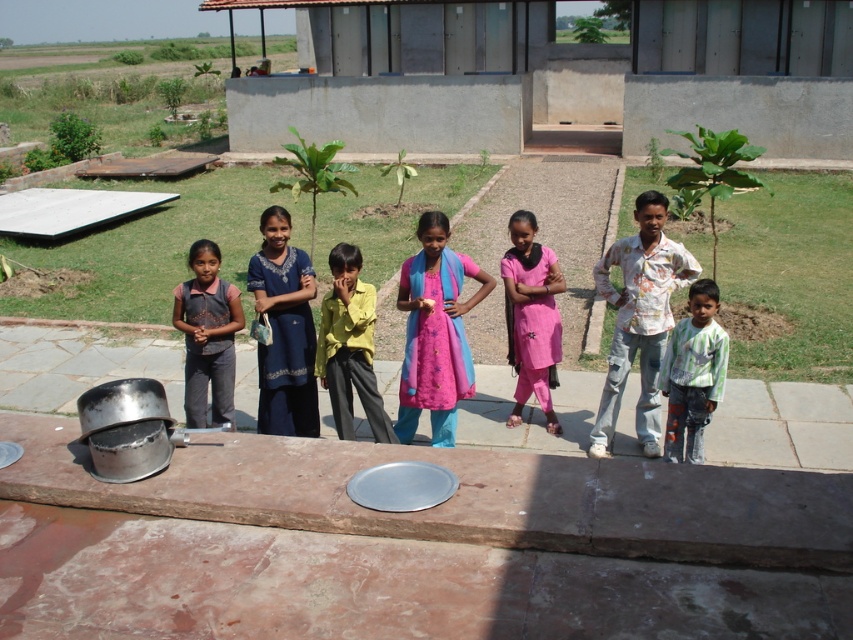
Between yellow matte shirt at center and striped cotton shirt at center, which one is positioned higher?

Answer: yellow matte shirt at center is above.

Can you confirm if yellow matte shirt at center is shorter than striped cotton shirt at center?

No, yellow matte shirt at center is not shorter than striped cotton shirt at center.

This screenshot has height=640, width=853. I want to click on yellow matte shirt at center, so click(349, 346).

Can you confirm if blue cotton dress at center is taller than yellow matte shirt at center?

Correct, blue cotton dress at center is much taller as yellow matte shirt at center.

What are the coordinates of `blue cotton dress at center` in the screenshot? It's located at (283, 330).

Is point (265, 371) positioned before point (680, 372)?

That is False.

Which is in front, point (270, 314) or point (697, 392)?

Point (697, 392) is more forward.

I want to click on blue cotton dress at center, so click(283, 330).

Where is `blue cotton dress at center`? The image size is (853, 640). blue cotton dress at center is located at coordinates (283, 330).